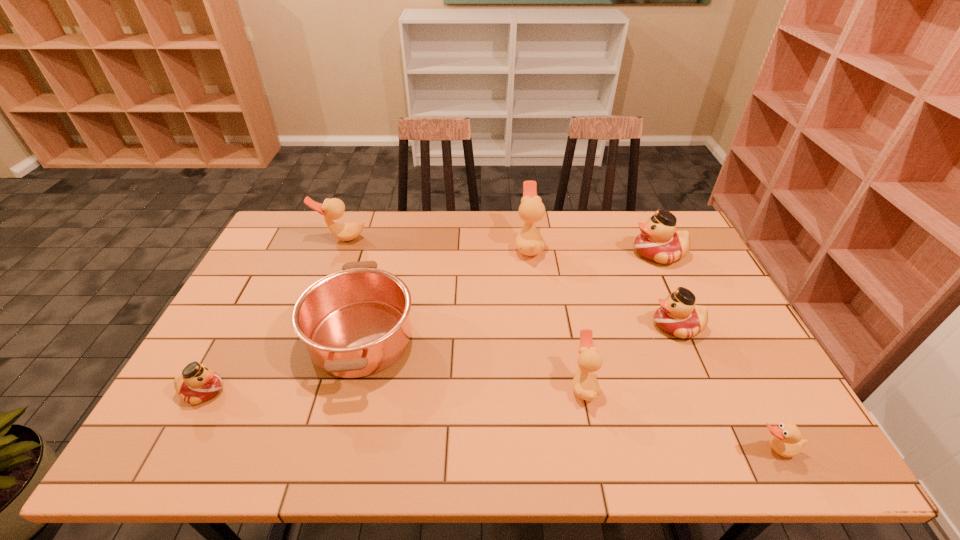
Locate an element on the screen. The height and width of the screenshot is (540, 960). free space that is in between the fifth duck from right to left and the third tan duck from left to right is located at coordinates (556, 316).

The height and width of the screenshot is (540, 960). In order to click on free area in between the fourth farthest duck and the smallest red duck in this screenshot , I will do `click(440, 359)`.

Image resolution: width=960 pixels, height=540 pixels. Find the location of `free space between the nearest object and the second smallest tan duck`. free space between the nearest object and the second smallest tan duck is located at coordinates (679, 417).

This screenshot has width=960, height=540. I want to click on free space between the second smallest tan duck and the farthest red duck, so coord(621,320).

Find the location of a particular element. Image resolution: width=960 pixels, height=540 pixels. unoccupied area between the farthest red duck and the biggest tan duck is located at coordinates (593, 250).

Where is `free space between the saucepan and the fourth duck from left to right`? The image size is (960, 540). free space between the saucepan and the fourth duck from left to right is located at coordinates (472, 362).

In order to click on vacant point located between the third duck from left to right and the leftmost tan duck in this screenshot , I will do `click(435, 242)`.

Identify which object is located as the third nearest to the fourth nearest duck. Please provide its 2D coordinates. Your answer should be formatted as a tuple, i.e. [(x, y)], where the tuple contains the x and y coordinates of a point satisfying the conditions above.

[(787, 441)]

Locate an element on the screen. The width and height of the screenshot is (960, 540). object that ranks as the third closest to the third duck from left to right is located at coordinates (678, 315).

Where is `duck that is the sixth nearest to the fourth duck from right to left`? The height and width of the screenshot is (540, 960). duck that is the sixth nearest to the fourth duck from right to left is located at coordinates (197, 384).